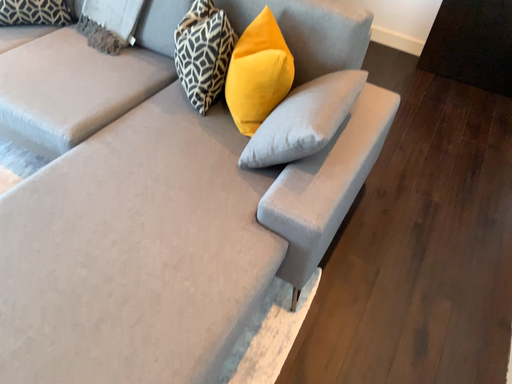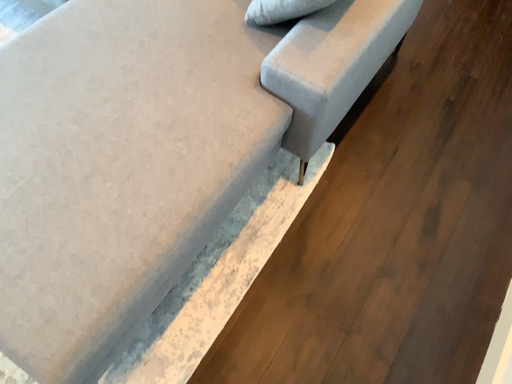
Question: Which way did the camera rotate in the video?

Choices:
 (A) rotated upward
 (B) rotated downward

Answer: (B)